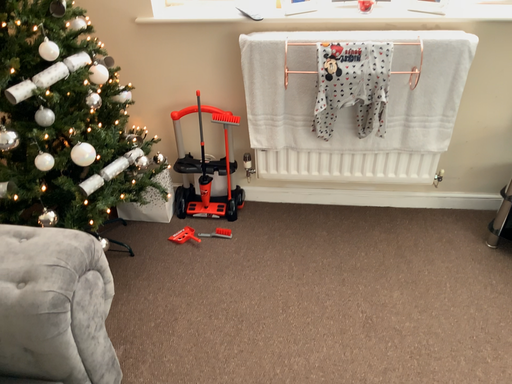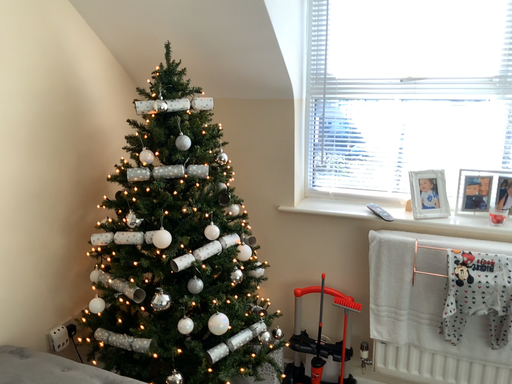
Question: Which way did the camera rotate in the video?

Choices:
 (A) rotated left
 (B) rotated right

Answer: (A)